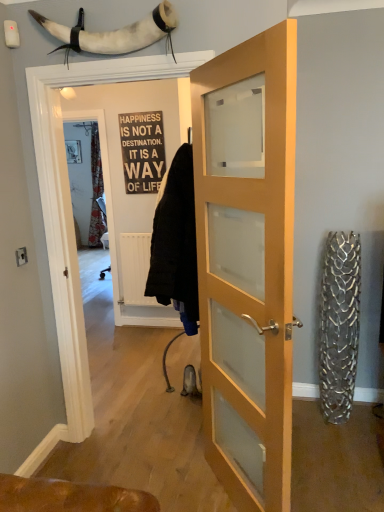
Question: Is light wood/glass door at center inside or outside of black wood sign at center?

Choices:
 (A) outside
 (B) inside

Answer: (A)

Question: Considering the positions of light wood/glass door at center and black wood sign at center in the image, is light wood/glass door at center wider or thinner than black wood sign at center?

Choices:
 (A) thin
 (B) wide

Answer: (B)

Question: Considering the real-world distances, which object is closest to the light wood/glass door at center?

Choices:
 (A) white horn at upper center
 (B) black wood sign at center

Answer: (A)

Question: Estimate the real-world distances between objects in this image. Which object is farther from the black wood sign at center?

Choices:
 (A) light wood/glass door at center
 (B) white horn at upper center

Answer: (A)